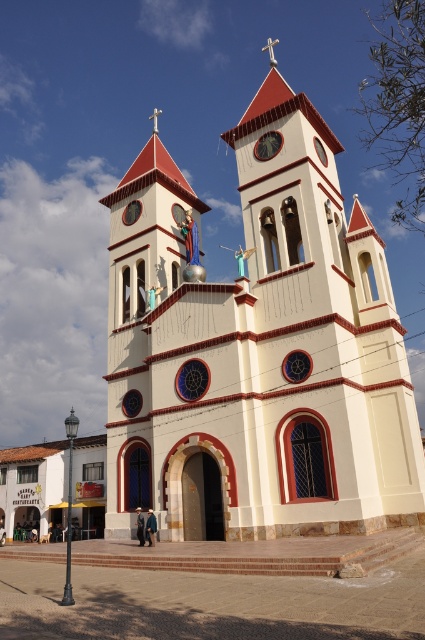
Question: Which point appears closest to the camera in this image?

Choices:
 (A) (261, 209)
 (B) (258, 152)

Answer: (A)

Question: Is the position of white stucco church tower at center more distant than that of metallic clock at upper center?

Choices:
 (A) yes
 (B) no

Answer: (B)

Question: Which object is closer to the camera taking this photo?

Choices:
 (A) metallic clock at upper center
 (B) white stucco church tower at center

Answer: (B)

Question: In this image, where is white stucco church tower at center located relative to metallic clock at upper center?

Choices:
 (A) right
 (B) left

Answer: (A)

Question: From the image, what is the correct spatial relationship of white stucco church tower at center in relation to metallic clock at upper center?

Choices:
 (A) right
 (B) left

Answer: (A)